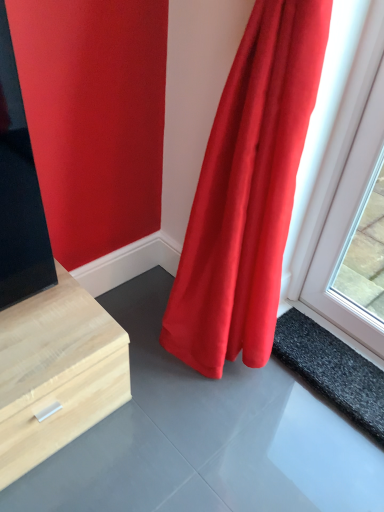
Question: Is matte red curtain at right surrounded by black rubber mat at lower right?

Choices:
 (A) no
 (B) yes

Answer: (A)

Question: Can you confirm if black rubber mat at lower right is taller than matte red curtain at right?

Choices:
 (A) no
 (B) yes

Answer: (A)

Question: Considering the relative sizes of black rubber mat at lower right and matte red curtain at right in the image provided, is black rubber mat at lower right bigger than matte red curtain at right?

Choices:
 (A) no
 (B) yes

Answer: (A)

Question: Would you consider black rubber mat at lower right to be distant from matte red curtain at right?

Choices:
 (A) yes
 (B) no

Answer: (B)

Question: Could you tell me if black rubber mat at lower right is facing matte red curtain at right?

Choices:
 (A) yes
 (B) no

Answer: (A)

Question: Does black rubber mat at lower right have a lesser height compared to matte red curtain at right?

Choices:
 (A) yes
 (B) no

Answer: (A)

Question: From a real-world perspective, is matte red curtain at right beneath black rubber mat at lower right?

Choices:
 (A) yes
 (B) no

Answer: (B)

Question: Is matte red curtain at right in front of black rubber mat at lower right?

Choices:
 (A) no
 (B) yes

Answer: (B)

Question: From the image's perspective, is matte red curtain at right beneath black rubber mat at lower right?

Choices:
 (A) no
 (B) yes

Answer: (A)

Question: Is there a large distance between matte red curtain at right and black rubber mat at lower right?

Choices:
 (A) yes
 (B) no

Answer: (B)

Question: Considering the relative sizes of matte red curtain at right and black rubber mat at lower right in the image provided, is matte red curtain at right smaller than black rubber mat at lower right?

Choices:
 (A) yes
 (B) no

Answer: (B)

Question: Is matte red curtain at right facing away from black rubber mat at lower right?

Choices:
 (A) yes
 (B) no

Answer: (A)

Question: In terms of height, does black rubber mat at lower right look taller or shorter compared to matte red curtain at right?

Choices:
 (A) tall
 (B) short

Answer: (B)